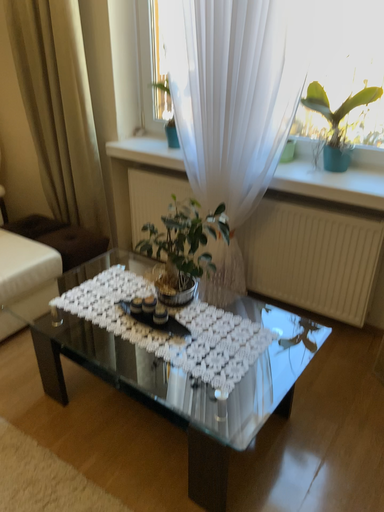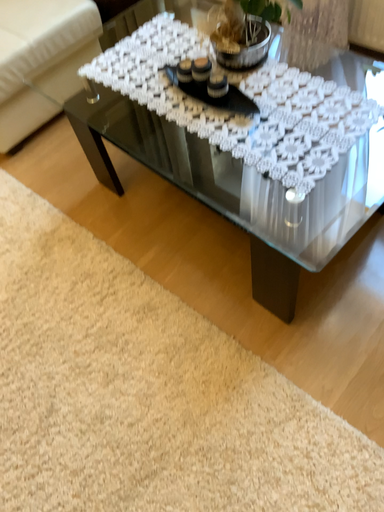
Question: How did the camera likely rotate when shooting the video?

Choices:
 (A) rotated downward
 (B) rotated upward

Answer: (A)